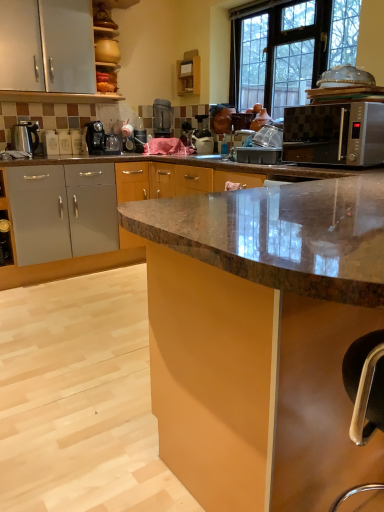
Question: Do you think transparent glass window at upper center is within matte brown cabinet at center, the 2th cabinetry from the back, or outside of it?

Choices:
 (A) outside
 (B) inside

Answer: (A)

Question: In terms of size, does transparent glass window at upper center appear bigger or smaller than matte brown cabinet at center, the second cabinetry in the top-to-bottom sequence?

Choices:
 (A) small
 (B) big

Answer: (A)

Question: Which is nearer to the satin black coffee machine at center, which appears as the first coffee machine when viewed from the front?

Choices:
 (A) satin black coffee machine at center, positioned as the first coffee machine in back-to-front order
 (B) transparent glass window at upper center
 (C) wooden shelf at upper center, the 2th cabinetry viewed from the front
 (D) metallic silver kettle at left
 (E) matte brown cabinet at center, the second cabinetry in the top-to-bottom sequence

Answer: (D)

Question: Estimate the real-world distances between objects in this image. Which object is closer to the wooden shelf at upper center, the second cabinetry viewed from the right?

Choices:
 (A) matte brown cabinet at center, the 2th cabinetry from the back
 (B) transparent glass window at upper center
 (C) metallic silver kettle at left
 (D) satin silver microwave at right
 (E) satin black coffee machine at center, placed as the first coffee machine when sorted from left to right

Answer: (B)